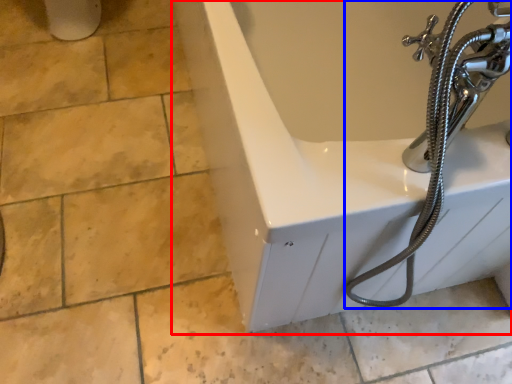
Question: Which object appears closest to the camera in this image, bathtub (highlighted by a red box) or garden hose (highlighted by a blue box)?

Choices:
 (A) bathtub
 (B) garden hose

Answer: (B)